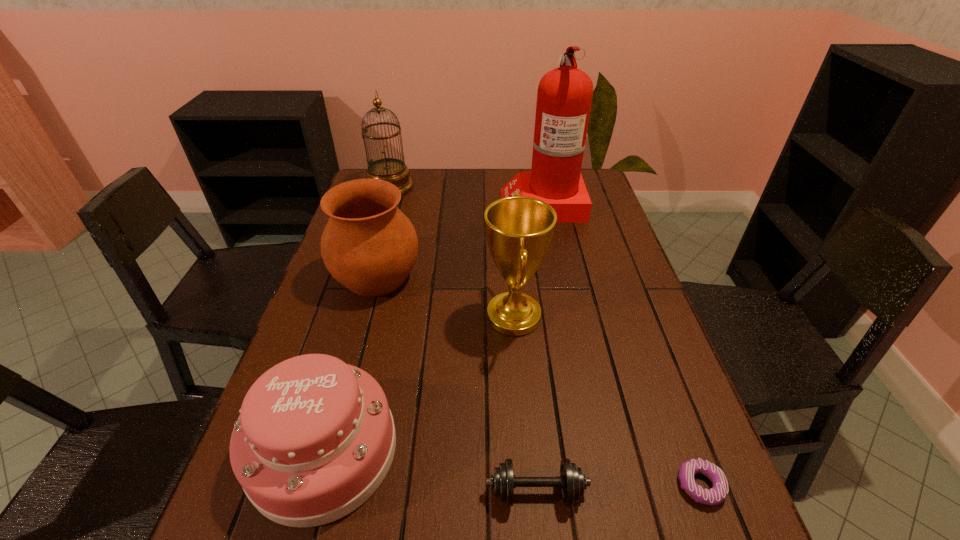
The width and height of the screenshot is (960, 540). I want to click on free point located on the front-facing side of the fire extinguisher, so click(473, 202).

In order to click on free space located with an open door on the birdcage in this screenshot , I will do `click(517, 187)`.

Where is `free space located by the handles of the award`? The image size is (960, 540). free space located by the handles of the award is located at coordinates (389, 316).

Locate an element on the screen. vacant space positioned by the handles of the award is located at coordinates (385, 316).

Where is `free space located 0.140m by the handles of the award`? This screenshot has height=540, width=960. free space located 0.140m by the handles of the award is located at coordinates (428, 316).

Identify the location of free space located on the right of the pottery. coord(479,276).

The image size is (960, 540). Find the location of `vacant region located 0.160m on the back of the third shortest object`. vacant region located 0.160m on the back of the third shortest object is located at coordinates (356, 334).

This screenshot has height=540, width=960. I want to click on vacant space located 0.050m on the back of the dumbbell, so click(532, 446).

The height and width of the screenshot is (540, 960). In order to click on vacant space located 0.230m on the left of the doughnut in this screenshot , I will do `click(550, 485)`.

Find the location of a particular element. fire extinguisher located in the far edge section of the desktop is located at coordinates (564, 97).